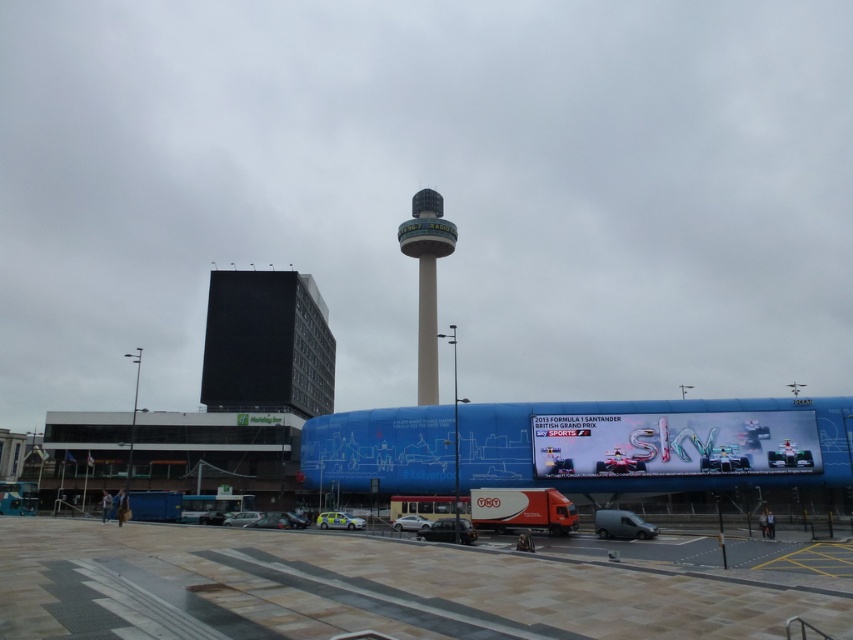
Can you confirm if paved stone tarmac at lower center is shorter than smooth concrete tower at center?

Yes, paved stone tarmac at lower center is shorter than smooth concrete tower at center.

Does paved stone tarmac at lower center appear on the right side of smooth concrete tower at center?

In fact, paved stone tarmac at lower center is to the left of smooth concrete tower at center.

Does point (430, 611) lie in front of point (431, 252)?

Yes.

Find the location of a particular element. The image size is (853, 640). paved stone tarmac at lower center is located at coordinates (361, 589).

The width and height of the screenshot is (853, 640). I want to click on metallic blue billboard at center, so click(x=675, y=444).

Can you confirm if metallic blue billboard at center is shorter than smooth concrete tower at center?

Correct, metallic blue billboard at center is not as tall as smooth concrete tower at center.

Locate an element on the screen. Image resolution: width=853 pixels, height=640 pixels. metallic blue billboard at center is located at coordinates (675, 444).

Locate an element on the screen. metallic blue billboard at center is located at coordinates (675, 444).

Which is more to the left, paved stone tarmac at lower center or metallic blue billboard at center?

Positioned to the left is paved stone tarmac at lower center.

Is paved stone tarmac at lower center bigger than metallic blue billboard at center?

Correct, paved stone tarmac at lower center is larger in size than metallic blue billboard at center.

Between point (439, 604) and point (622, 428), which one is positioned behind?

Positioned behind is point (622, 428).

Find the location of a particular element. This screenshot has height=640, width=853. paved stone tarmac at lower center is located at coordinates (361, 589).